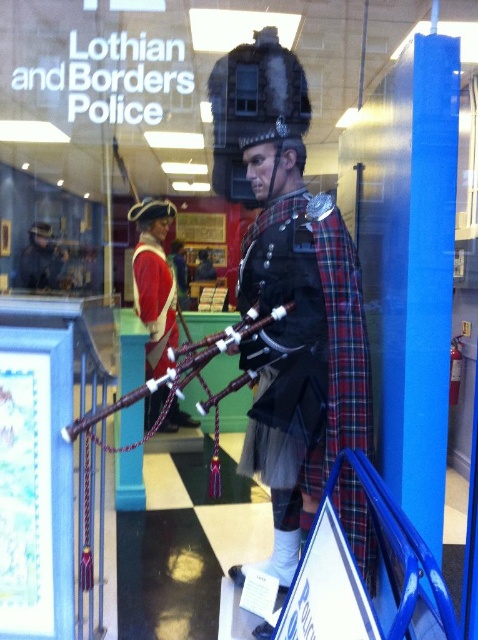
You are a visitor standing in front of the museum display window. You notice the red wool uniform at center and the wooden pipes at center. Which object is closer to you?

The red wool uniform at center is closer to you because the wooden pipes at center are positioned behind it.

You are a visitor standing in front of the museum display window. You notice two uniforms at the center of the display. Which one is taller, the matte black kilt at center or the red wool uniform at center?

The matte black kilt at center is taller than the red wool uniform at center according to the description.

You are a visitor standing in front of the display window. You notice the matte black kilt at center and the wooden pipes at center. Which object is closer to you?

The matte black kilt at center is closer because the wooden pipes at center are positioned behind it.